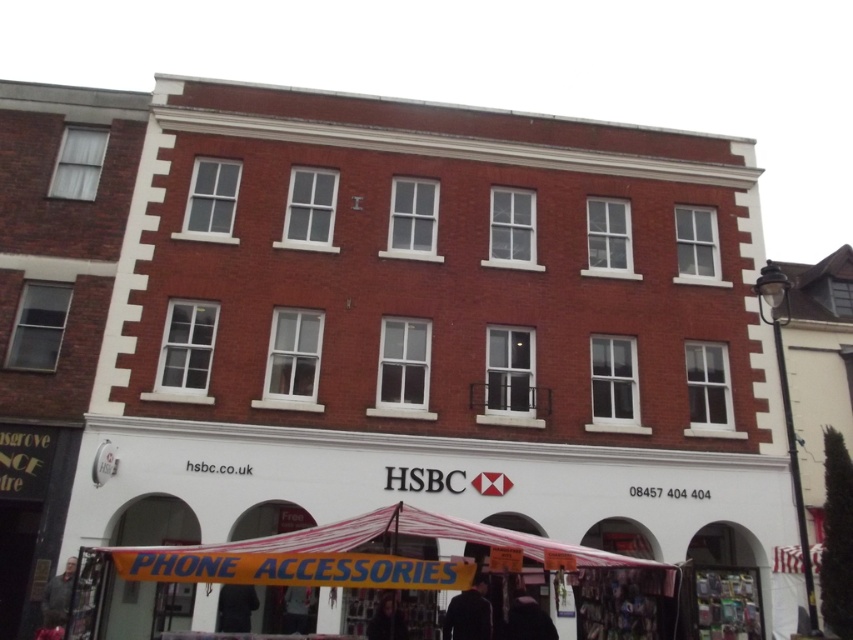
Question: Which point is closer to the camera?

Choices:
 (A) yellow fabric canopy at lower center
 (B) black fabric at lower center
 (C) dark fabric jacket at lower center
 (D) dark hair at lower center

Answer: (A)

Question: Does yellow fabric canopy at lower center appear on the right side of black fabric at lower center?

Choices:
 (A) yes
 (B) no

Answer: (A)

Question: Does yellow fabric canopy at lower center have a larger size compared to black fabric at lower center?

Choices:
 (A) yes
 (B) no

Answer: (A)

Question: Which of the following is the closest to the observer?

Choices:
 (A) (451, 604)
 (B) (50, 624)
 (C) (527, 611)
 (D) (451, 540)

Answer: (D)

Question: Which point is farther to the camera?

Choices:
 (A) (488, 611)
 (B) (375, 616)
 (C) (238, 584)
 (D) (544, 627)

Answer: (B)

Question: Does dark blue fabric at lower center have a larger size compared to black fabric at lower center?

Choices:
 (A) no
 (B) yes

Answer: (B)